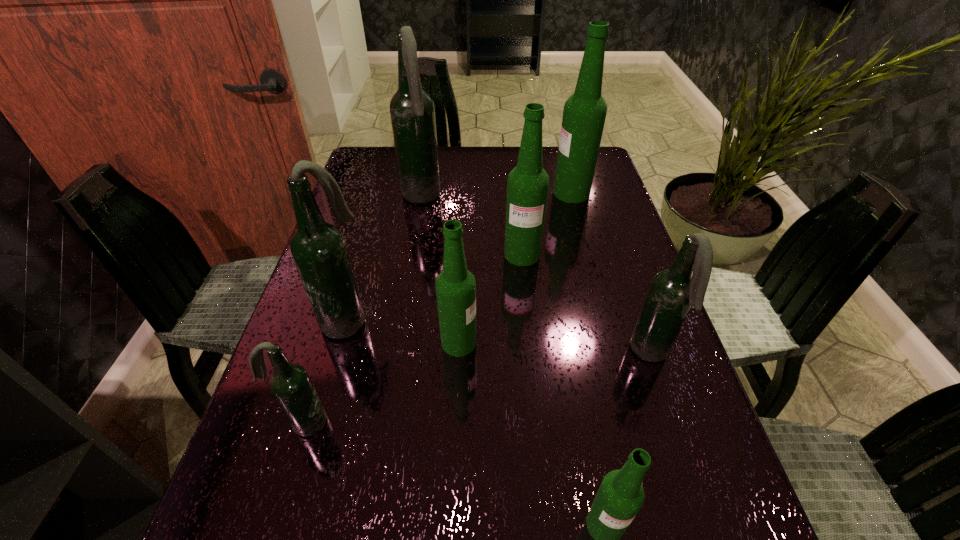
Locate an element on the screen. the rightmost green beer bottle is located at coordinates (584, 114).

This screenshot has height=540, width=960. I want to click on the farthest green beer bottle, so click(584, 114).

You are a GUI agent. You are given a task and a screenshot of the screen. Output one action in this format:
    pyautogui.click(x=<x>, y=<y>)
    Task: Click on the second dark beer bottle from right to left
    The height and width of the screenshot is (540, 960).
    Given the screenshot: What is the action you would take?
    pyautogui.click(x=412, y=111)

The width and height of the screenshot is (960, 540). I want to click on the sixth object from right to left, so click(412, 111).

Identify the location of the second biggest green beer bottle. (527, 186).

Locate an element on the screen. the sixth nearest beer bottle is located at coordinates (527, 186).

Where is `the second biggest dark beer bottle`? the second biggest dark beer bottle is located at coordinates (318, 248).

Where is `the leftmost green beer bottle`? the leftmost green beer bottle is located at coordinates (455, 286).

Identify the location of the second smallest green beer bottle. (455, 286).

At what (x,y) coordinates should I click in order to perform the action: click on the third biggest dark beer bottle. Please return your answer as a coordinate pair (x, y). The height and width of the screenshot is (540, 960). Looking at the image, I should click on (673, 291).